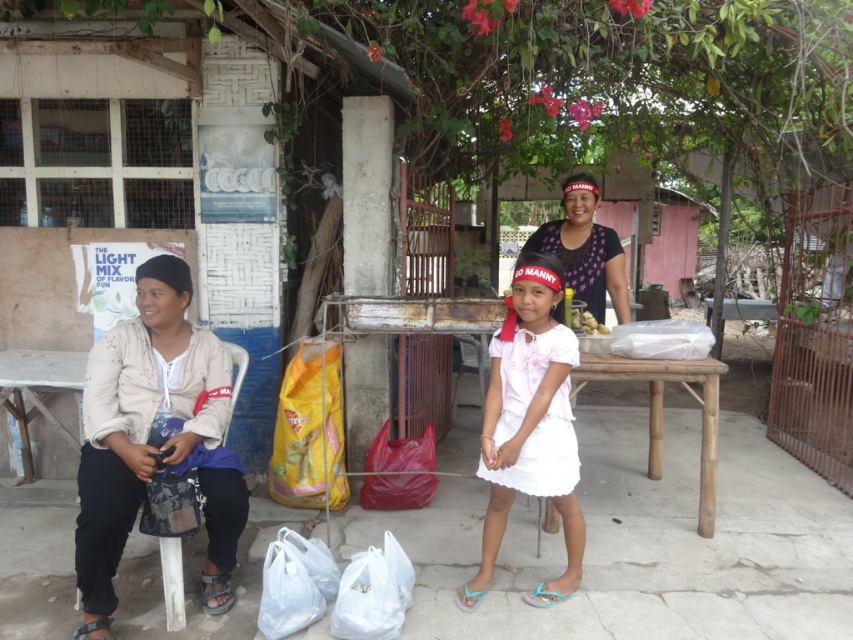
You are standing at the center of the scene and want to go to the white painted wood hut at left. In which direction should you walk?

Since the white painted wood hut at left is located at point (195, 161), you should walk to the left from your current position at the center to reach it.

You are a photographer trying to capture a photo of the matte pink fabric at center without including the white painted wood hut at left in the frame. Based on their positions, is this possible?

The white painted wood hut at left is positioned on the left side of matte pink fabric at center, so it is possible to capture the matte pink fabric at center without including the white painted wood hut at left by framing the shot to exclude the left side.

You are standing in front of the scene and want to determine which of the two points, point (x=492, y=464) or point (x=577, y=173), is closer to you. Based on the description, which point is nearer?

Point (x=492, y=464) is closer to the camera than point (x=577, y=173).